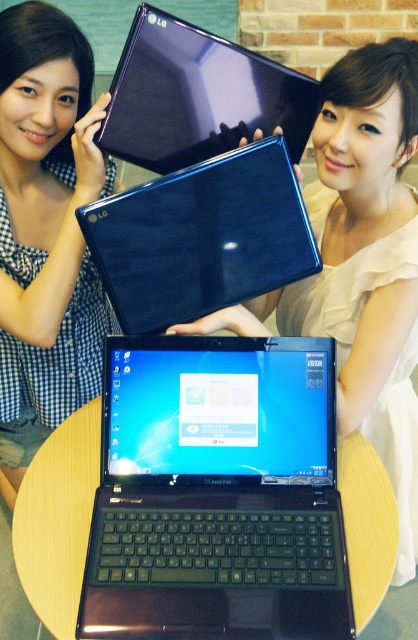
Question: Based on their relative distances, which object is nearer to the matte blue laptop at center?

Choices:
 (A) glossy blue laptop at upper center
 (B) metallic blue laptop at center
 (C) white checkered dress at left
 (D) glossy plastic laptop at upper center

Answer: (A)

Question: Does matte blue laptop at center come behind glossy plastic laptop at upper center?

Choices:
 (A) yes
 (B) no

Answer: (B)

Question: Which object is farther from the camera taking this photo?

Choices:
 (A) glossy plastic laptop at upper center
 (B) glossy blue laptop at upper center
 (C) matte blue laptop at center

Answer: (A)

Question: Can you confirm if white checkered dress at left is bigger than glossy plastic laptop at upper center?

Choices:
 (A) no
 (B) yes

Answer: (B)

Question: Considering the relative positions of matte blue laptop at center and glossy blue laptop at upper center in the image provided, where is matte blue laptop at center located with respect to glossy blue laptop at upper center?

Choices:
 (A) left
 (B) right

Answer: (B)

Question: Estimate the real-world distances between objects in this image. Which object is closer to the white checkered dress at left?

Choices:
 (A) metallic blue laptop at center
 (B) glossy blue laptop at upper center

Answer: (B)